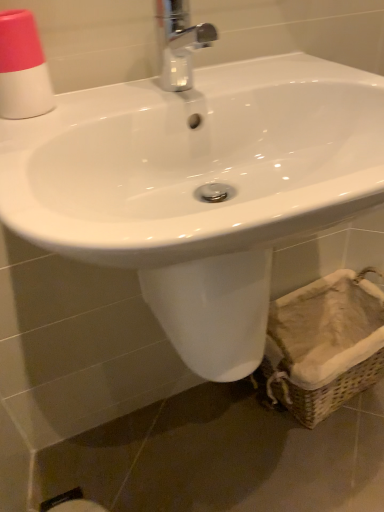
Question: Is pink matte cup at upper left inside the boundaries of woven beige basket at lower right, or outside?

Choices:
 (A) inside
 (B) outside

Answer: (B)

Question: Does point (31, 18) appear closer or farther from the camera than point (319, 340)?

Choices:
 (A) closer
 (B) farther

Answer: (A)

Question: Based on their relative distances, which object is nearer to the white glossy sink at center?

Choices:
 (A) chrome metallic faucet at upper center
 (B) pink matte cup at upper left
 (C) woven beige basket at lower right

Answer: (A)

Question: Estimate the real-world distances between objects in this image. Which object is closer to the white glossy sink at center?

Choices:
 (A) pink matte cup at upper left
 (B) chrome metallic faucet at upper center
 (C) woven beige basket at lower right

Answer: (B)